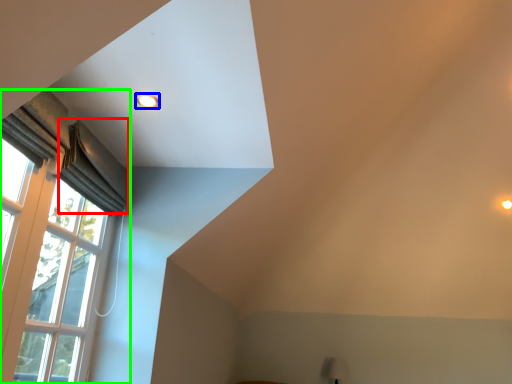
Question: Which object is positioned closest to curtain (highlighted by a red box)? Select from lighting (highlighted by a blue box) and window (highlighted by a green box).

Choices:
 (A) lighting
 (B) window

Answer: (B)